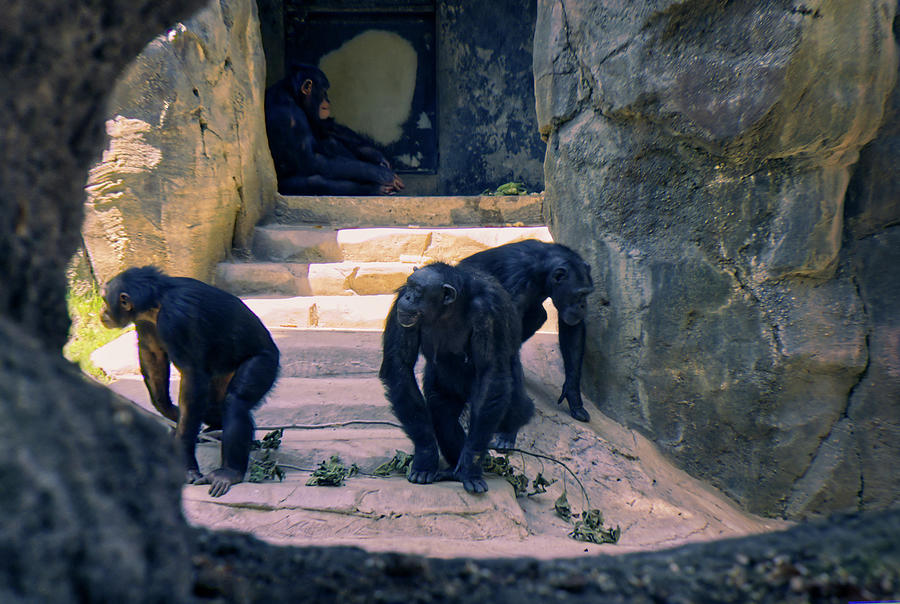
At what (x,y) coordinates should I click in order to perform the action: click on wall. Please return your answer as a coordinate pair (x, y). Image resolution: width=900 pixels, height=604 pixels. Looking at the image, I should click on (758, 206), (180, 87), (515, 117), (158, 506).